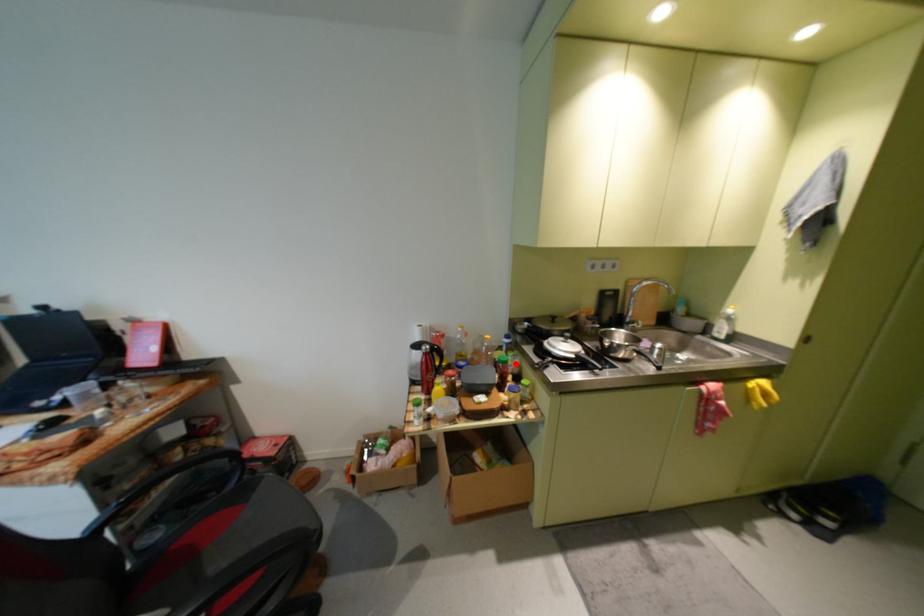
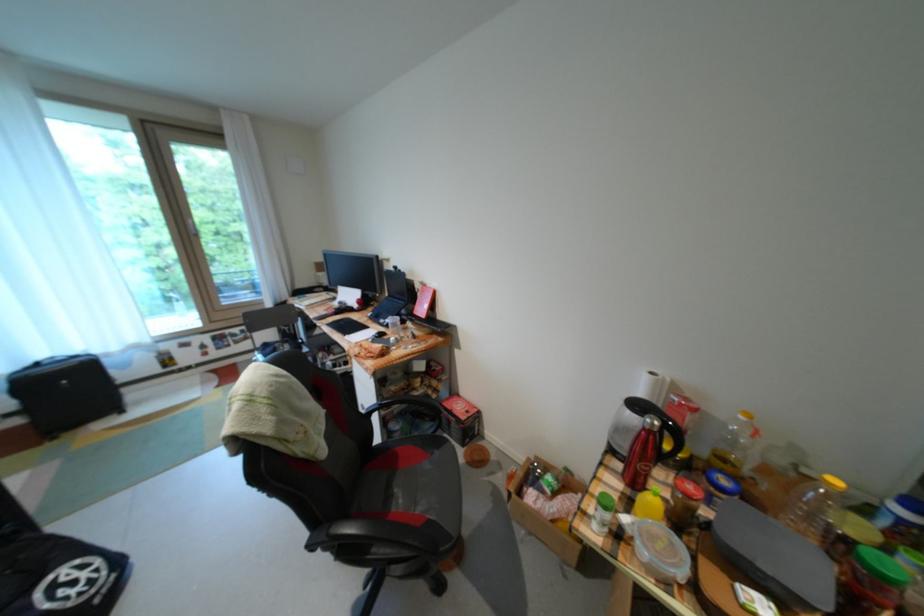
In the second image, find the point that corresponds to the highlighted location in the first image.

(898, 583)